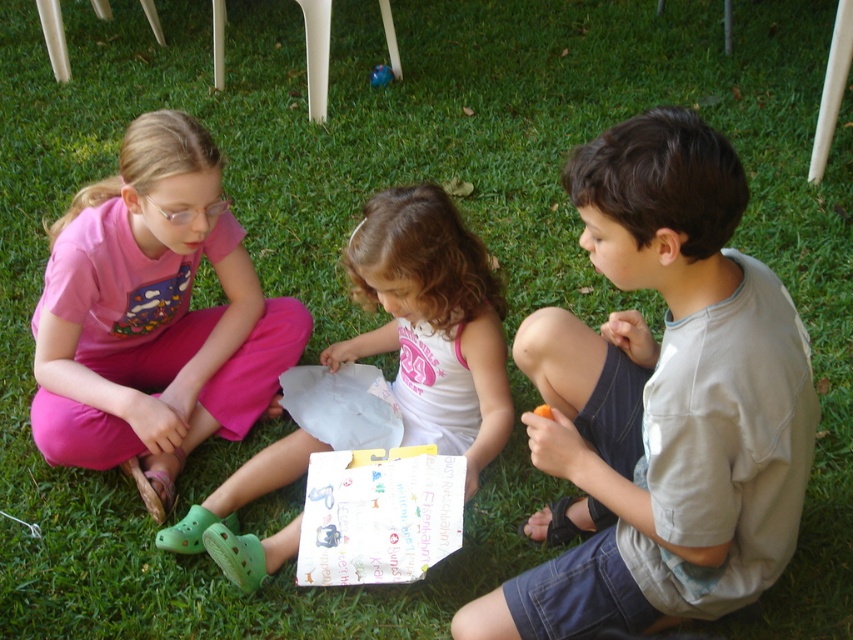
Does light gray cotton shirt at center have a greater width compared to pink cotton shirt at left?

In fact, light gray cotton shirt at center might be narrower than pink cotton shirt at left.

Locate an element on the screen. This screenshot has width=853, height=640. light gray cotton shirt at center is located at coordinates (660, 401).

Is pink cotton shirt at left to the right of pink fabric dress at center from the viewer's perspective?

No, pink cotton shirt at left is not to the right of pink fabric dress at center.

From the picture: Is pink cotton shirt at left bigger than pink fabric dress at center?

Actually, pink cotton shirt at left might be smaller than pink fabric dress at center.

Is point (102, 262) closer to camera compared to point (457, 243)?

No, it is not.

Find the location of a particular element. Image resolution: width=853 pixels, height=640 pixels. pink cotton shirt at left is located at coordinates pos(154,316).

Between point (636, 625) and point (440, 262), which one is positioned behind?

The point (440, 262) is behind.

Who is lower down, light gray cotton shirt at center or pink fabric dress at center?

pink fabric dress at center is below.

Does point (572, 358) come closer to viewer compared to point (471, 276)?

Yes, it is.

Where is `light gray cotton shirt at center`? This screenshot has width=853, height=640. light gray cotton shirt at center is located at coordinates pos(660,401).